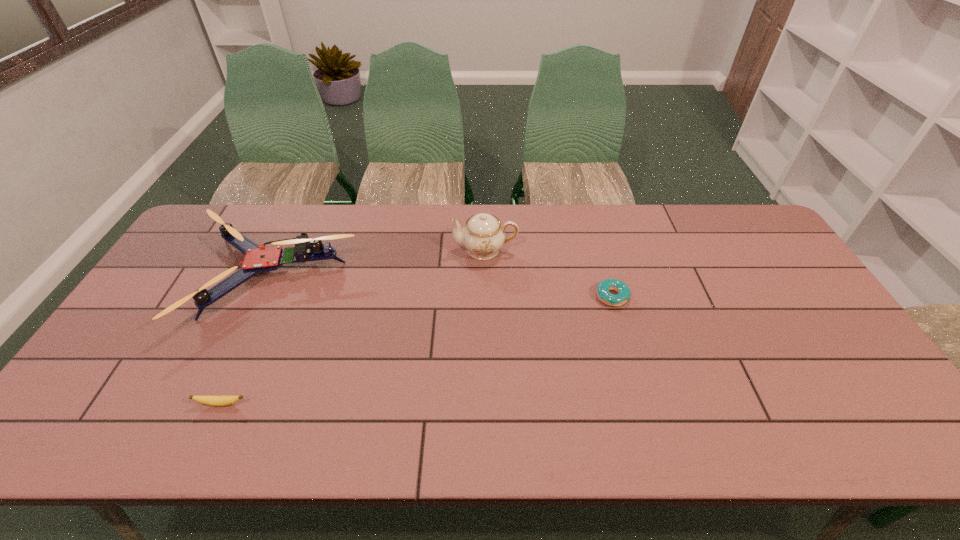
The image size is (960, 540). In order to click on free space located on the back of the banana in this screenshot , I will do (x=262, y=313).

What are the coordinates of `chinaware at the far edge` in the screenshot? It's located at (483, 236).

At what (x,y) coordinates should I click in order to perform the action: click on drone situated at the far edge. Please return your answer as a coordinate pair (x, y). This screenshot has width=960, height=540. Looking at the image, I should click on (257, 259).

The height and width of the screenshot is (540, 960). Find the location of `object present at the left edge`. object present at the left edge is located at coordinates (257, 259).

Locate an element on the screen. This screenshot has width=960, height=540. object that is at the far left corner is located at coordinates (257, 259).

In the image, there is a desktop. Where is `vacant space at the far edge`? The width and height of the screenshot is (960, 540). vacant space at the far edge is located at coordinates (702, 239).

Identify the location of vacant space at the near edge. This screenshot has height=540, width=960. click(766, 435).

In order to click on free space at the left edge of the desktop in this screenshot , I will do `click(176, 261)`.

This screenshot has height=540, width=960. What are the coordinates of `free space at the right edge of the desktop` in the screenshot? It's located at (864, 407).

In the image, there is a desktop. Where is `vacant area at the near left corner`? The width and height of the screenshot is (960, 540). vacant area at the near left corner is located at coordinates (123, 428).